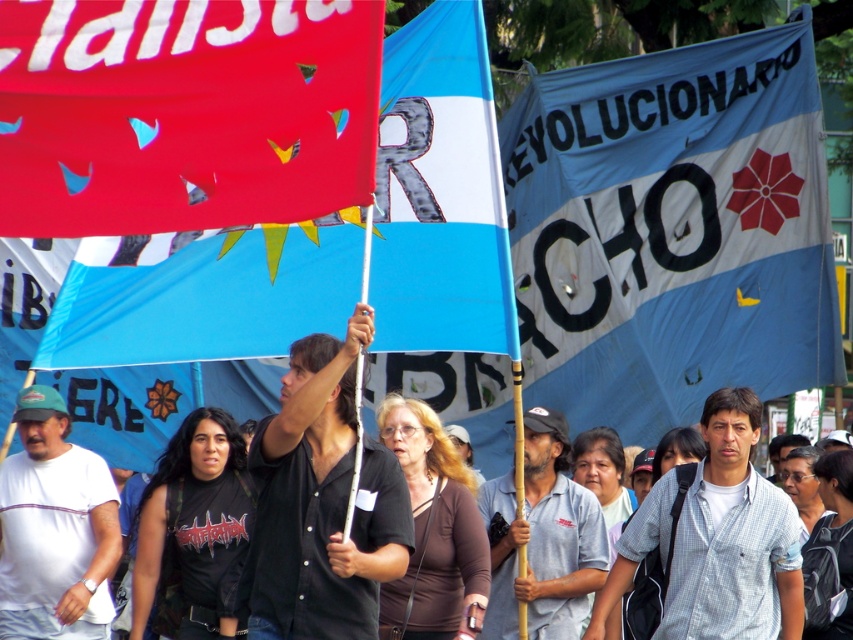
Who is lower down, matte red flag at upper left or gray checkered shirt at center?

gray checkered shirt at center is lower down.

Is matte red flag at upper left closer to camera compared to gray checkered shirt at center?

Yes, matte red flag at upper left is closer to the viewer.

Image resolution: width=853 pixels, height=640 pixels. I want to click on matte red flag at upper left, so click(184, 113).

Does blue fabric banner at center have a greater height compared to matte red flag at upper left?

Yes.

Is blue fabric banner at center to the left of matte red flag at upper left from the viewer's perspective?

In fact, blue fabric banner at center is to the right of matte red flag at upper left.

This screenshot has height=640, width=853. What are the coordinates of `blue fabric banner at center` in the screenshot? It's located at (672, 230).

Find the location of a particular element. Image resolution: width=853 pixels, height=640 pixels. blue fabric banner at center is located at coordinates (672, 230).

Who is positioned more to the right, matte red flag at upper left or white matte t-shirt at left?

matte red flag at upper left is more to the right.

Can you confirm if matte red flag at upper left is positioned to the right of white matte t-shirt at left?

Yes, matte red flag at upper left is to the right of white matte t-shirt at left.

The image size is (853, 640). What do you see at coordinates (184, 113) in the screenshot?
I see `matte red flag at upper left` at bounding box center [184, 113].

Find the location of `matte red flag at upper left`. matte red flag at upper left is located at coordinates (184, 113).